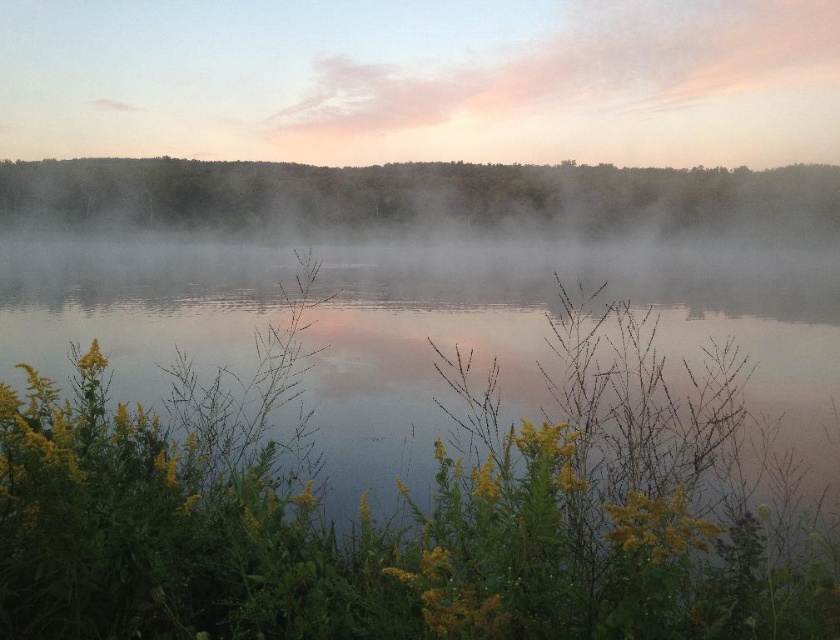
Question: Which point is closer to the camera?

Choices:
 (A) green leafy trees at upper center
 (B) transparent misty water at center

Answer: (B)

Question: Can you confirm if transparent misty water at center is positioned below green leafy trees at upper center?

Choices:
 (A) no
 (B) yes

Answer: (B)

Question: Among these objects, which one is farthest from the camera?

Choices:
 (A) transparent misty water at center
 (B) green leafy trees at upper center

Answer: (B)

Question: Is transparent misty water at center closer to the viewer compared to green leafy trees at upper center?

Choices:
 (A) no
 (B) yes

Answer: (B)

Question: Which point appears farthest from the camera in this image?

Choices:
 (A) (93, 259)
 (B) (74, 177)

Answer: (B)

Question: Is transparent misty water at center thinner than green leafy trees at upper center?

Choices:
 (A) no
 (B) yes

Answer: (B)